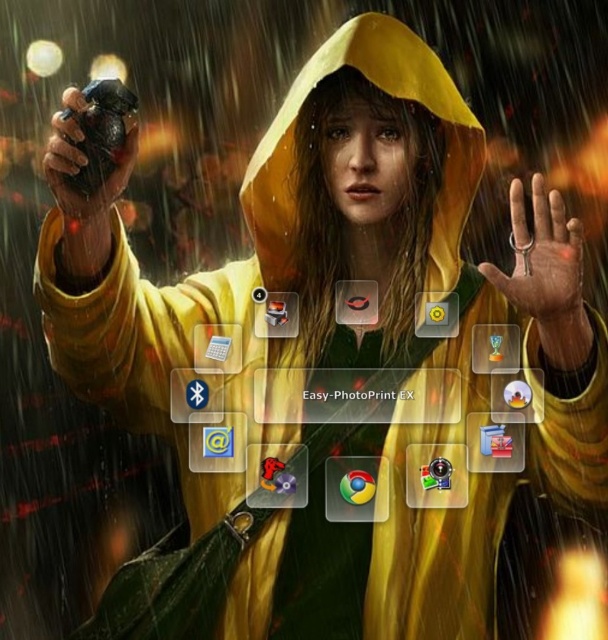
You are a drone operator trying to locate two points in an emergency scene. The first point is at coordinates point(285,138) and the second is at point(105,92). Based on the scene description, which point is closer to the person in the yellow raincoat?

Point(105,92) is closer to the person in the yellow raincoat because it is in front of point(285,138).

You are a delivery robot in a rainstorm. You need to pick up the smooth metallic key at center and the rubberized black grip at left. Can you reach both items at the same time with your 1 meter long robotic arms?

The smooth metallic key at center is 98.68 centimeters from the rubberized black grip at left. Since your robotic arms are 1 meter long, you can extend them to reach both items simultaneously.

You are a delivery person who needs to protect your phone from the rain. You see the yellow matte hood at center and the rubberized black grip at left. Which object can you use to cover your phone to keep it dry?

The yellow matte hood at center is positioned over the rubberized black grip at left, so you can use the yellow matte hood at center to cover your phone and keep it dry.